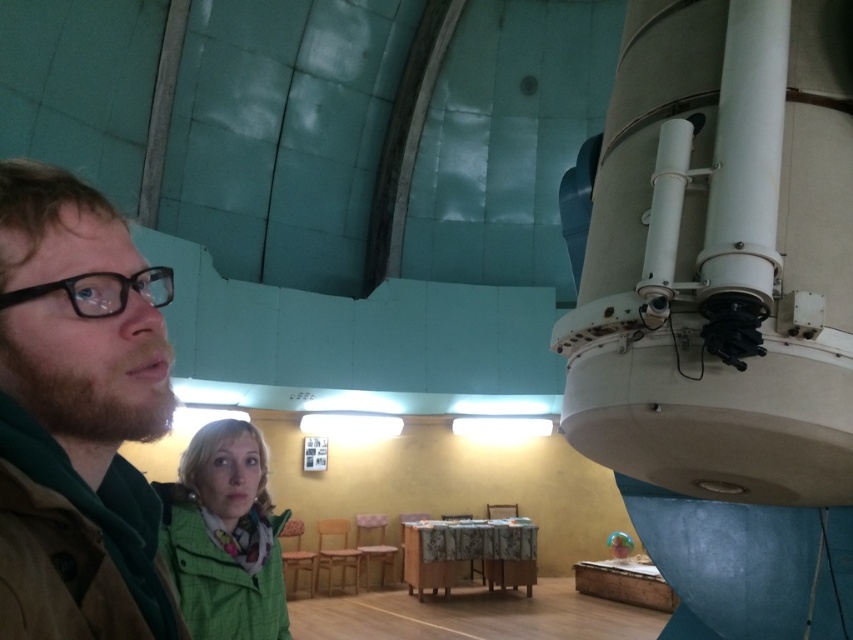
Is point (137, 400) closer to viewer compared to point (233, 508)?

Yes, it is in front of point (233, 508).

Who is positioned more to the right, brown leather jacket at left or green fabric jacket at lower left?

brown leather jacket at left is more to the right.

Who is more distant from viewer, [123,428] or [206,620]?

The point [206,620] is more distant.

Identify the location of brown leather jacket at left. The image size is (853, 640). (80, 467).